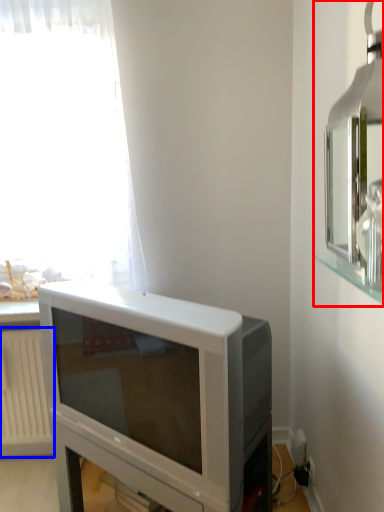
Question: Which object appears farthest to the camera in this image, medicine cabinet (highlighted by a red box) or radiator (highlighted by a blue box)?

Choices:
 (A) medicine cabinet
 (B) radiator

Answer: (B)